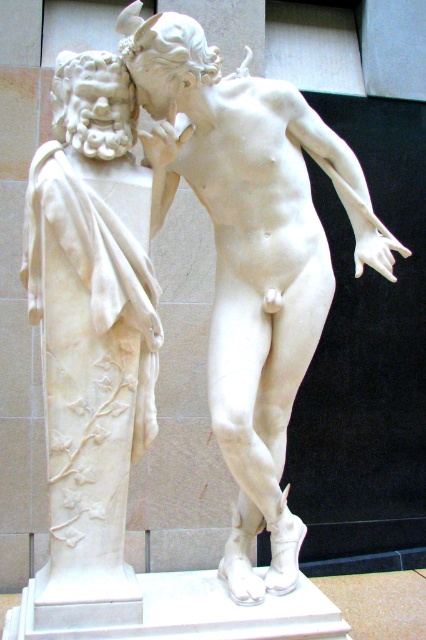
Which is behind, point (244, 301) or point (43, 387)?

Positioned behind is point (43, 387).

The image size is (426, 640). I want to click on white marble statue at center, so click(250, 257).